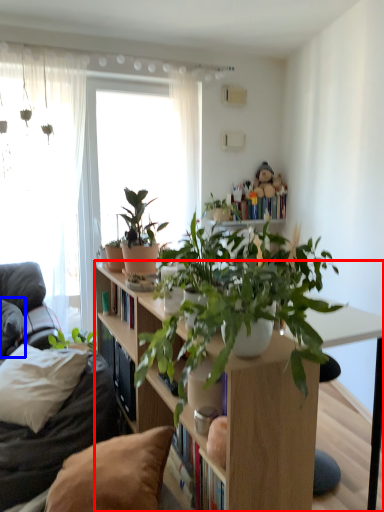
Question: Which object is closer to the camera taking this photo, bookcase (highlighted by a red box) or pillow (highlighted by a blue box)?

Choices:
 (A) bookcase
 (B) pillow

Answer: (A)